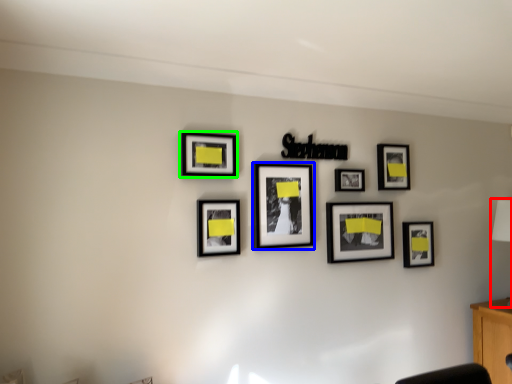
Question: Which object is the closest to the table lamp (highlighted by a red box)? Choose among these: picture frame (highlighted by a blue box) or picture frame (highlighted by a green box).

Choices:
 (A) picture frame
 (B) picture frame

Answer: (A)